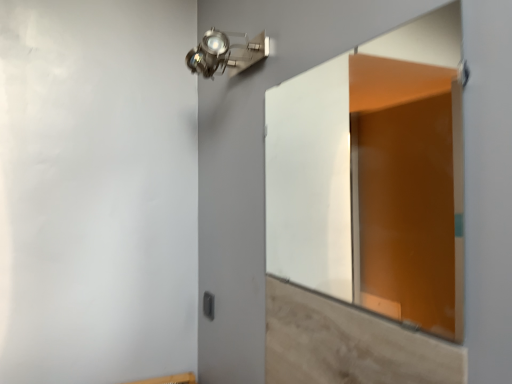
Question: Is the surface of light brown wood at lower right in direct contact with black plastic switch at lower center?

Choices:
 (A) yes
 (B) no

Answer: (B)

Question: Is light brown wood at lower right shorter than black plastic switch at lower center?

Choices:
 (A) yes
 (B) no

Answer: (B)

Question: From a real-world perspective, is light brown wood at lower right on top of black plastic switch at lower center?

Choices:
 (A) no
 (B) yes

Answer: (B)

Question: Is light brown wood at lower right not within black plastic switch at lower center?

Choices:
 (A) yes
 (B) no

Answer: (A)

Question: Does light brown wood at lower right appear on the left side of black plastic switch at lower center?

Choices:
 (A) no
 (B) yes

Answer: (A)

Question: Is black plastic switch at lower center surrounded by light brown wood at lower right?

Choices:
 (A) no
 (B) yes

Answer: (A)

Question: Is metallic spot light at upper center a part of black plastic switch at lower center?

Choices:
 (A) no
 (B) yes

Answer: (A)

Question: Is black plastic switch at lower center to the right of metallic spot light at upper center from the viewer's perspective?

Choices:
 (A) no
 (B) yes

Answer: (A)

Question: Is black plastic switch at lower center positioned in front of metallic spot light at upper center?

Choices:
 (A) yes
 (B) no

Answer: (B)

Question: Is black plastic switch at lower center oriented away from metallic spot light at upper center?

Choices:
 (A) no
 (B) yes

Answer: (A)

Question: Can you confirm if black plastic switch at lower center is shorter than metallic spot light at upper center?

Choices:
 (A) yes
 (B) no

Answer: (A)

Question: Does black plastic switch at lower center have a larger size compared to metallic spot light at upper center?

Choices:
 (A) no
 (B) yes

Answer: (A)

Question: Is transparent glass door at center far away from metallic spot light at upper center?

Choices:
 (A) yes
 (B) no

Answer: (A)